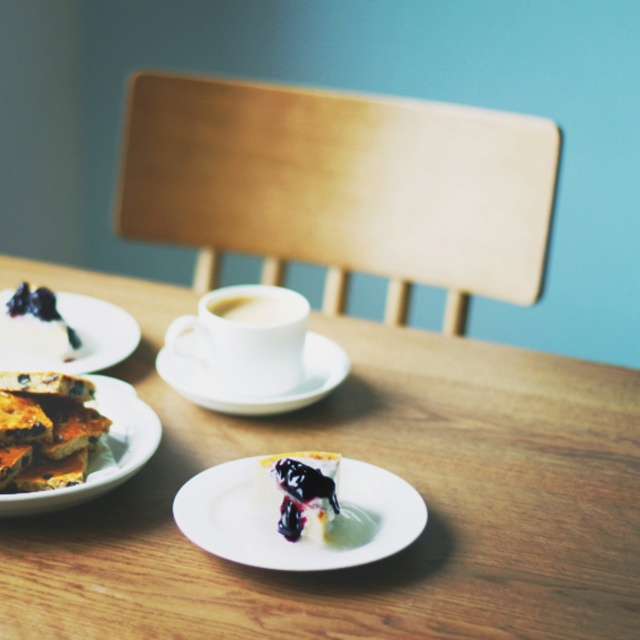
From the picture: You are planning to place a decorative vase on the wooden table at center. Given that the table is at coordinates 0.725, 0.584, can you confirm the exact position to place the vase?

The wooden table at center is located at point (372,464), so you should place the vase at those coordinates.

You are a waiter carrying a tray and need to place a dessert plate and a coffee cup on the table. The dessert plate must be placed near the matte brown plate at lower left, and the coffee cup must be placed near the white glossy cup at center. However, you have to ensure that the new items are at least 8 inches apart from each other. Can you do this?

The matte brown plate at lower left and white glossy cup at center are currently 6.59 inches apart. Since the required distance is 8 inches, the new items cannot be placed as requested because the existing distance is less than the required separation.

You are a small toy car that is 25 centimeters long. You want to move from the wooden table at center to the white matte plate at lower left. Can you fit through the space between them?

The wooden table at center and the white matte plate at lower left are 24.79 centimeters apart from each other. Since the toy car is 25 centimeters long, it cannot fit through the space between them as the distance is slightly less than the car length.